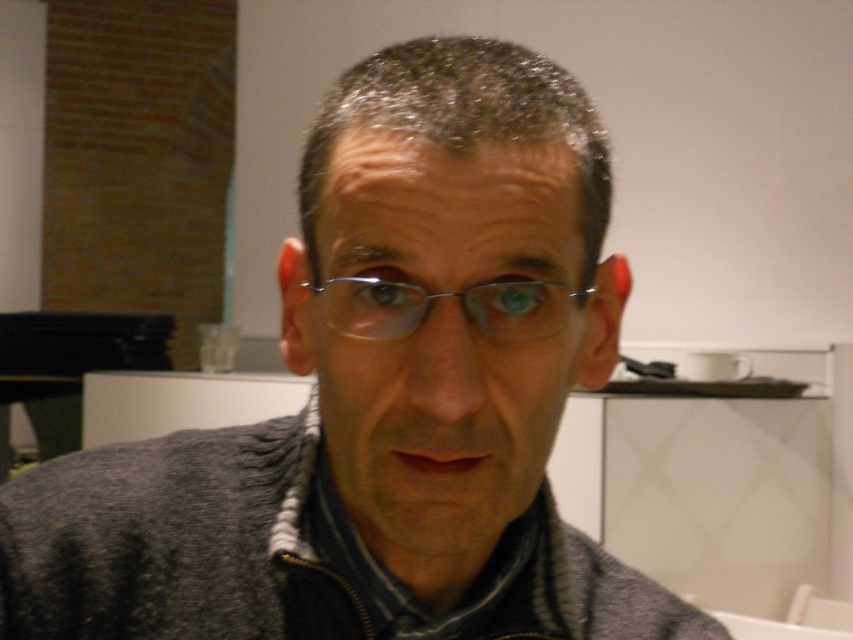
You are an interior designer analyzing the placement of objects in the scene. Given that the matte gray sweater at center is positioned at coordinates point 0.528, 0.528, can you determine if it is centered both horizontally and vertically in the image?

The matte gray sweater at center is located at point [450,337], which is very close to the center coordinates of an image typically being at [426,320]. Therefore, it is nearly centered both horizontally and vertically.

You are trying to determine if the matte gray sweater at center can completely cover the metallic frame glasses at center when placed directly over them. Based on their sizes, is this possible?

The matte gray sweater at center might be wider than metallic frame glasses at center, so it could potentially cover them if positioned correctly.